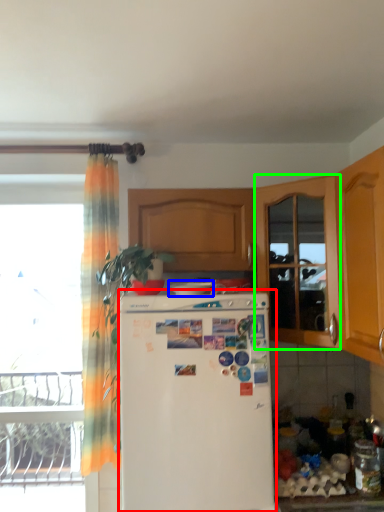
Question: Which object is the closest to the refrigerator (highlighted by a red box)? Choose among these: appliance (highlighted by a blue box) or screen door (highlighted by a green box).

Choices:
 (A) appliance
 (B) screen door

Answer: (A)